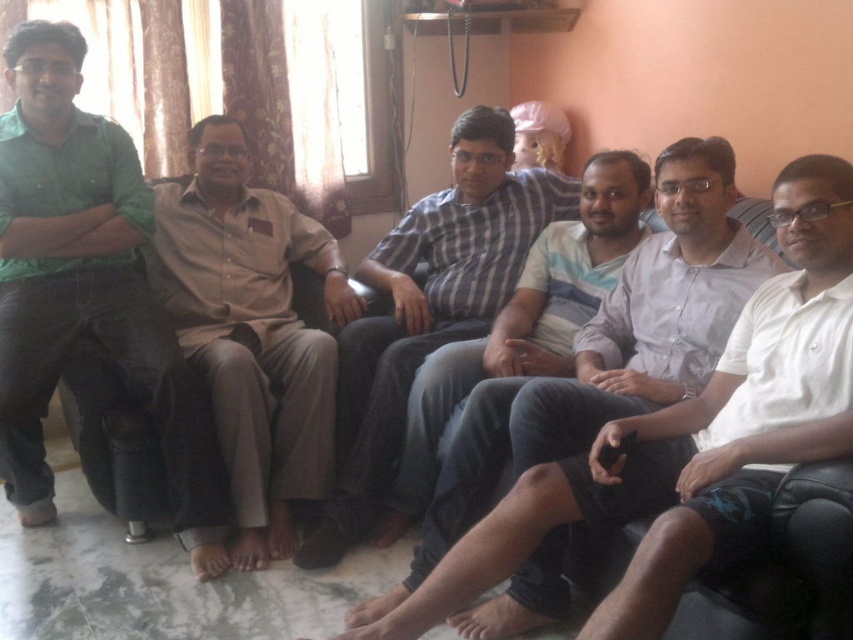
You are a photographer trying to capture a closeup of the beige cotton shirt at center without including the striped cotton shirt at center in the frame. Is this possible given their positions?

The beige cotton shirt at center is above the striped cotton shirt at center, so by angling the camera downward to focus on the beige cotton shirt at center, you can exclude the striped cotton shirt at center from the frame.

Please look at the scene and identify which object corresponds to the coordinates provided. The coordinates are point (85, 285). The objects available are the green matte shirt at left and the floral patterned curtains. Which one is located at those coordinates?

The point (85, 285) marks the green matte shirt at left.